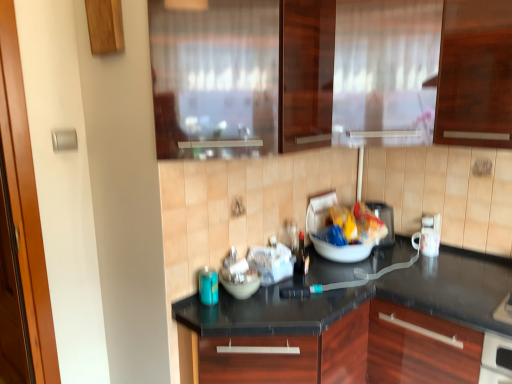
Question: Can you confirm if transparent glass window at upper center is positioned to the right of matte plastic bag at center?

Choices:
 (A) yes
 (B) no

Answer: (B)

Question: Does transparent glass window at upper center contain matte plastic bag at center?

Choices:
 (A) no
 (B) yes

Answer: (A)

Question: Considering the relative sizes of transparent glass window at upper center and matte plastic bag at center in the image provided, is transparent glass window at upper center shorter than matte plastic bag at center?

Choices:
 (A) no
 (B) yes

Answer: (A)

Question: From the image's perspective, does transparent glass window at upper center appear lower than matte plastic bag at center?

Choices:
 (A) no
 (B) yes

Answer: (A)

Question: Is the position of transparent glass window at upper center less distant than that of matte plastic bag at center?

Choices:
 (A) no
 (B) yes

Answer: (B)

Question: Choose the correct answer: Is blue glass bottle at lower left, which is counted as the 3th appliance, starting from the right, inside white glossy mug at right, the second appliance in the back-to-front sequence, or outside it?

Choices:
 (A) outside
 (B) inside

Answer: (A)

Question: Considering the relative positions of blue glass bottle at lower left, which is counted as the 3th appliance, starting from the right, and white glossy mug at right, which appears as the third appliance when viewed from the left, in the image provided, is blue glass bottle at lower left, which is counted as the 3th appliance, starting from the right, to the left or to the right of white glossy mug at right, which appears as the third appliance when viewed from the left,?

Choices:
 (A) left
 (B) right

Answer: (A)

Question: In the image, is blue glass bottle at lower left, the first appliance positioned from the left, positioned in front of or behind white glossy mug at right, the second appliance in the back-to-front sequence?

Choices:
 (A) front
 (B) behind

Answer: (A)

Question: From the image's perspective, is blue glass bottle at lower left, the first appliance positioned from the left, above or below white glossy mug at right, the second appliance in the back-to-front sequence?

Choices:
 (A) above
 (B) below

Answer: (B)

Question: In the image, is matte plastic bag at center on the left side or the right side of matte plastic toaster at center, arranged as the second appliance when viewed from the right?

Choices:
 (A) right
 (B) left

Answer: (B)

Question: In terms of width, does matte plastic bag at center look wider or thinner when compared to matte plastic toaster at center, the 3th appliance in the front-to-back sequence?

Choices:
 (A) wide
 (B) thin

Answer: (B)

Question: From the image's perspective, is matte plastic bag at center located above or below matte plastic toaster at center, which ranks as the 2th appliance in left-to-right order?

Choices:
 (A) below
 (B) above

Answer: (B)

Question: Does point (379, 221) appear closer or farther from the camera than point (387, 208)?

Choices:
 (A) closer
 (B) farther

Answer: (A)

Question: Does point (349, 61) appear closer or farther from the camera than point (388, 226)?

Choices:
 (A) farther
 (B) closer

Answer: (B)

Question: From the image's perspective, is frosted glass curtain at upper center positioned above or below matte plastic toaster at center, which ranks as the 2th appliance in left-to-right order?

Choices:
 (A) below
 (B) above

Answer: (B)